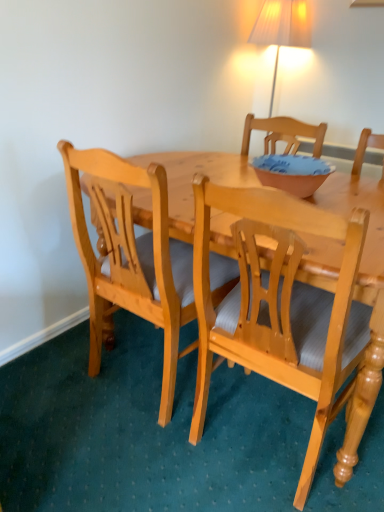
The image size is (384, 512). In order to click on free area below light wood chair at center, the first chair positioned from the left (from a real-world perspective) in this screenshot , I will do `click(152, 382)`.